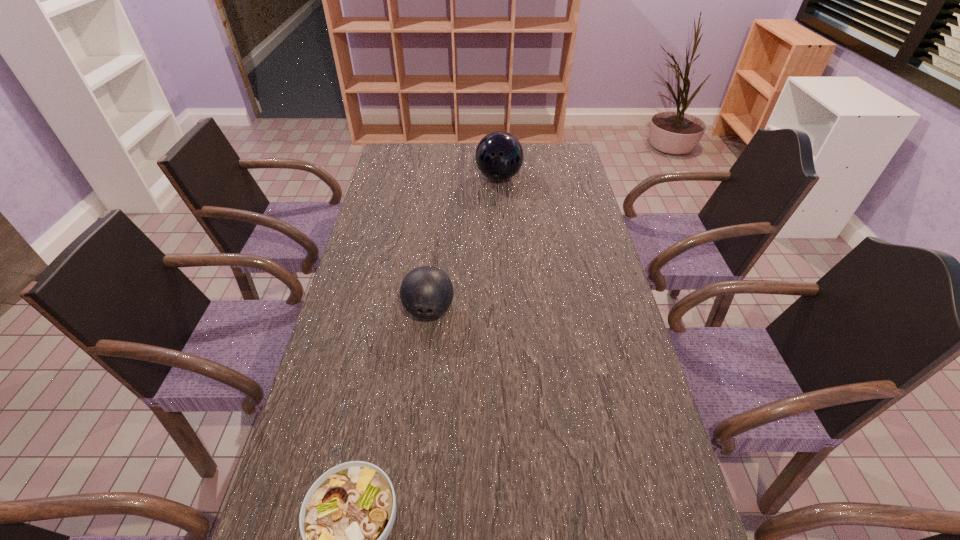
Where is `free space between the rightmost object and the second nearest object`? This screenshot has width=960, height=540. free space between the rightmost object and the second nearest object is located at coordinates (x=464, y=244).

Where is `the second closest object relative to the rightmost object`? Image resolution: width=960 pixels, height=540 pixels. the second closest object relative to the rightmost object is located at coordinates (348, 513).

Identify which object is the second closest to the left bowling ball. Please provide its 2D coordinates. Your answer should be formatted as a tuple, i.e. [(x, y)], where the tuple contains the x and y coordinates of a point satisfying the conditions above.

[(499, 156)]